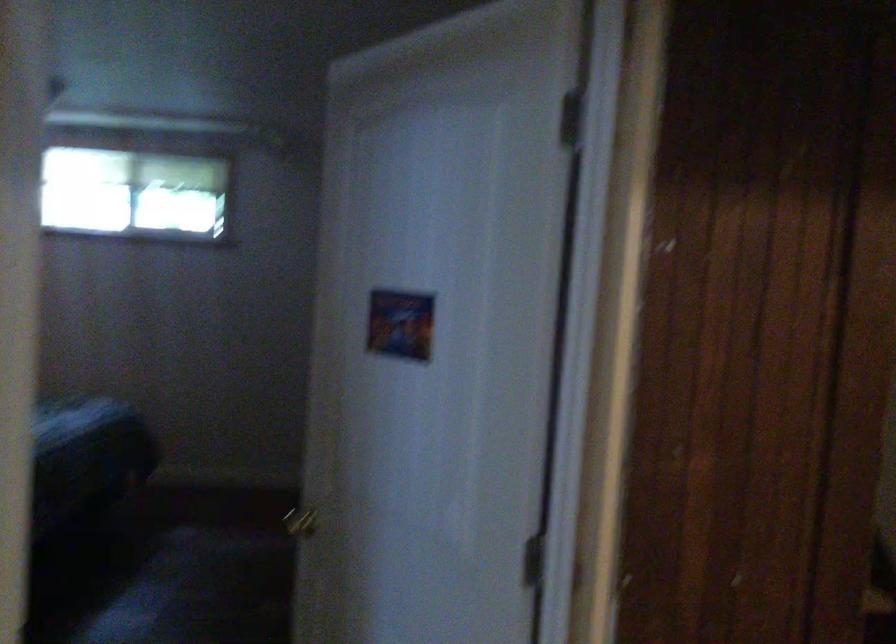
You are a GUI agent. You are given a task and a screenshot of the screen. Output one action in this format:
    pyautogui.click(x=<x>, y=<y>)
    Task: Click on the gold doorknob
    
    Given the screenshot: What is the action you would take?
    pyautogui.click(x=300, y=521)